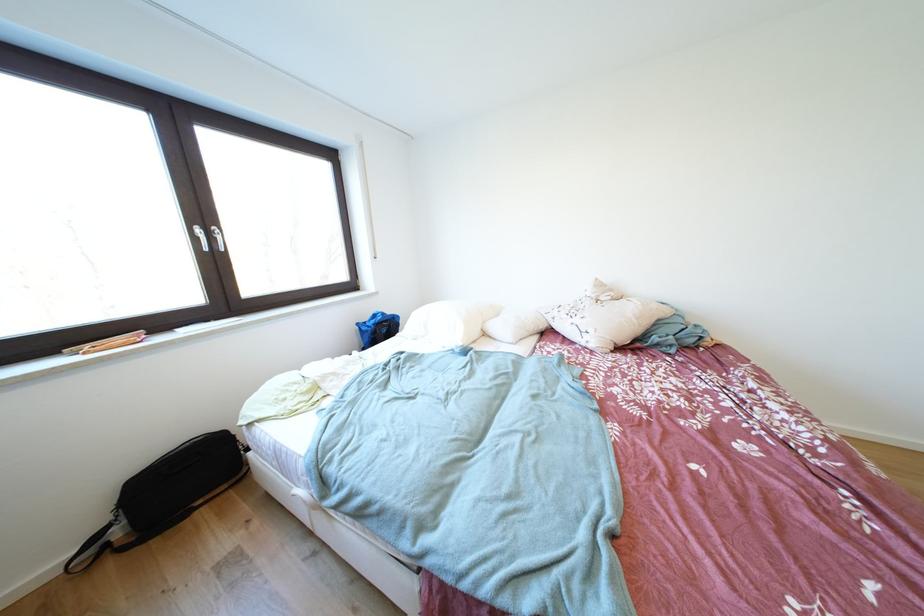
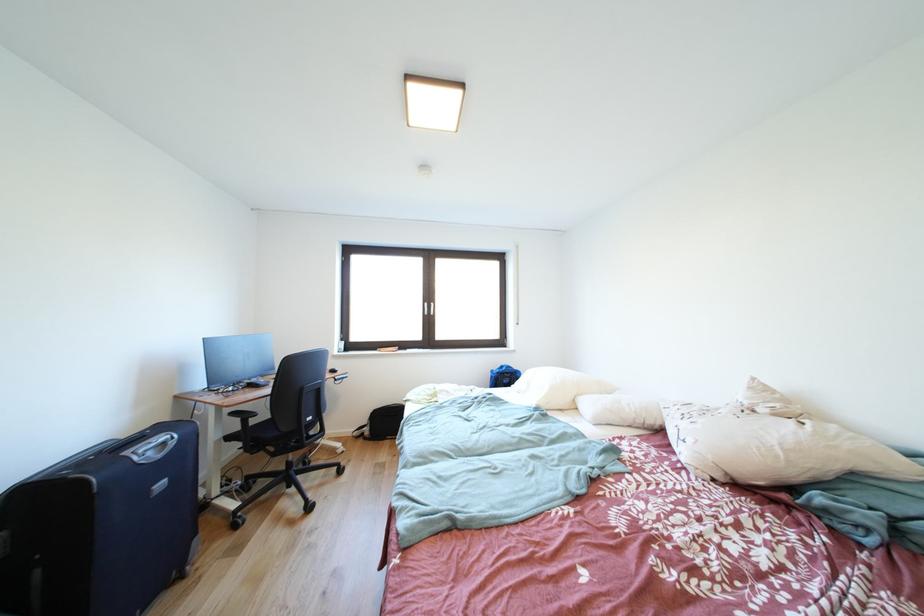
In the second image, find the point that corresponds to the point at 407,321 in the first image.

(528, 377)